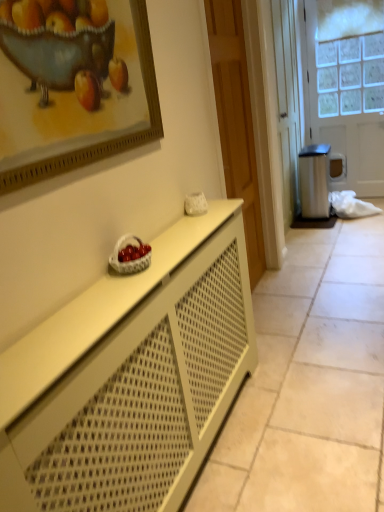
Find the location of a particular element. This screenshot has height=512, width=384. free location in front of white wicker basket at center is located at coordinates (114, 290).